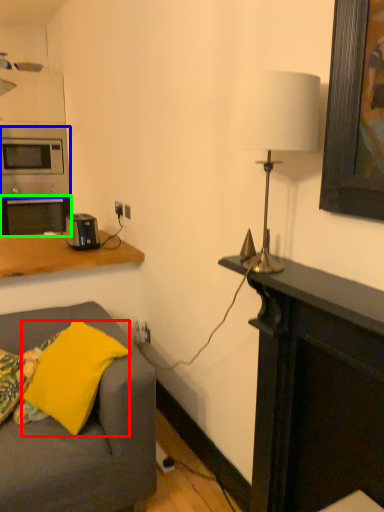
Question: Based on their relative distances, which object is farther from pillow (highlighted by a red box)? Choose from microwave oven (highlighted by a blue box) and oven (highlighted by a green box).

Choices:
 (A) microwave oven
 (B) oven

Answer: (A)